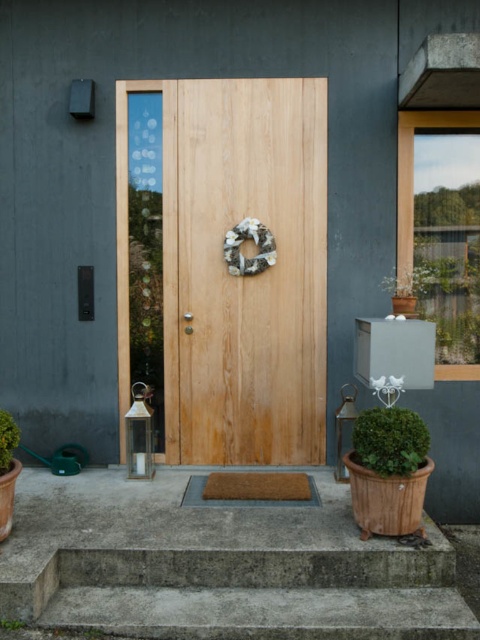
Question: Among these objects, which one is farthest from the camera?

Choices:
 (A) natural wood door at center
 (B) green leafy plant at lower left

Answer: (A)

Question: Estimate the real-world distances between objects in this image. Which object is closer to the natural wood door at center?

Choices:
 (A) green leafy plant at lower left
 (B) concrete stairs at lower center
 (C) green leafy bush at lower left

Answer: (B)

Question: Does green matte potted plant at lower right lie in front of green leafy bush at lower left?

Choices:
 (A) yes
 (B) no

Answer: (B)

Question: Does natural wood door at center appear on the left side of green leafy plant at lower left?

Choices:
 (A) yes
 (B) no

Answer: (B)

Question: Can you confirm if natural wood door at center is positioned to the left of concrete stairs at lower center?

Choices:
 (A) yes
 (B) no

Answer: (A)

Question: Considering the real-world distances, which object is farthest from the natural wood door at center?

Choices:
 (A) concrete stairs at lower center
 (B) green leafy bush at lower left

Answer: (B)